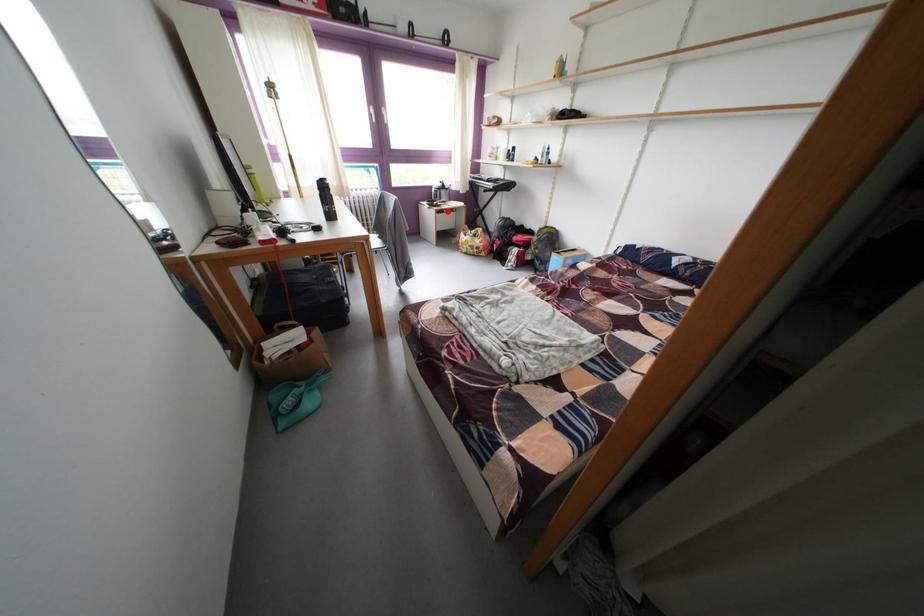
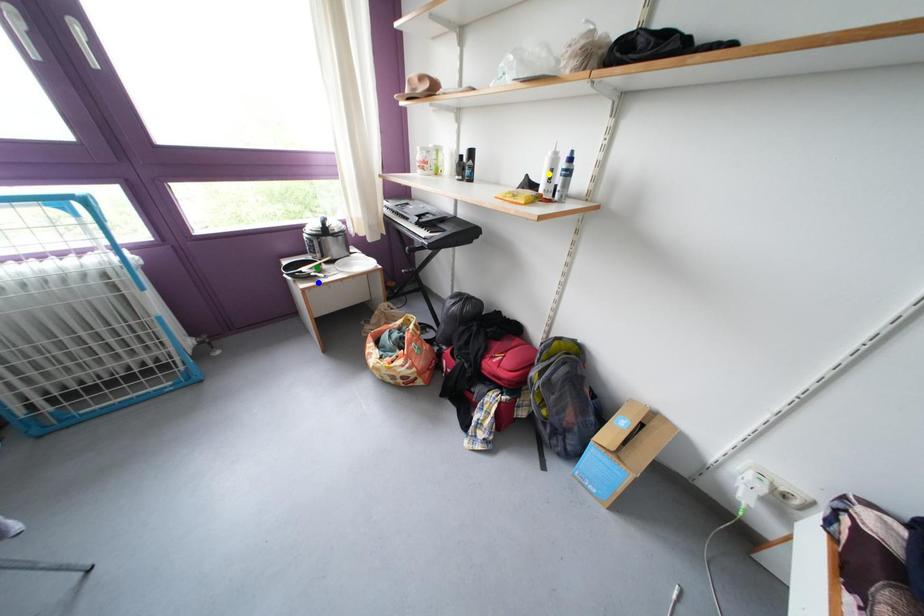
Question: I am providing you with two images of the same scene from different viewpoints. A red point is marked on the first image. You are given multiple points on the second image. Can you choose the point in image 2 that corresponds to the point in image 1?

Choices:
 (A) green point
 (B) yellow point
 (C) blue point

Answer: (C)